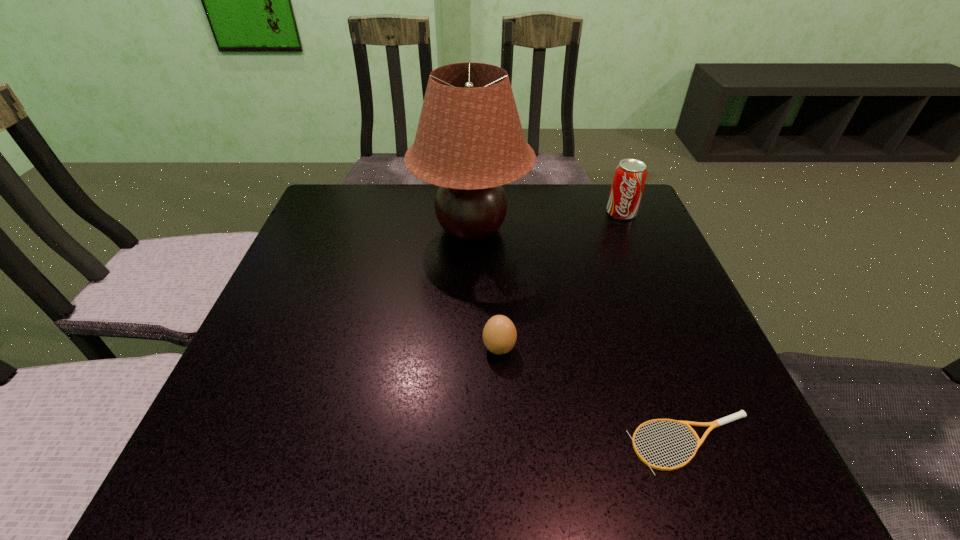
The height and width of the screenshot is (540, 960). I want to click on lampshade, so click(x=469, y=141).

The width and height of the screenshot is (960, 540). Find the location of `soda can`. soda can is located at coordinates (630, 175).

Locate an element on the screen. The image size is (960, 540). the second nearest object is located at coordinates (499, 335).

Where is `the second shortest object`? Image resolution: width=960 pixels, height=540 pixels. the second shortest object is located at coordinates (499, 335).

You are a GUI agent. You are given a task and a screenshot of the screen. Output one action in this format:
    pyautogui.click(x=<x>, y=<y>)
    Task: Click on the shortest object
    The image size is (960, 540).
    Given the screenshot: What is the action you would take?
    pyautogui.click(x=741, y=414)

This screenshot has height=540, width=960. Identify the location of the nearest object. (741, 414).

Where is `free space located 0.130m on the front-facing side of the lampshade`? The image size is (960, 540). free space located 0.130m on the front-facing side of the lampshade is located at coordinates coord(581,229).

The width and height of the screenshot is (960, 540). I want to click on vacant region located 0.150m on the left of the soda can, so click(549, 213).

Find the location of a particular element. This screenshot has height=540, width=960. free space located on the back of the second shortest object is located at coordinates (494, 241).

At what (x,y) coordinates should I click in order to perform the action: click on vacant position located on the back of the tennis racket. Please return your answer as a coordinate pair (x, y). Looking at the image, I should click on (625, 264).